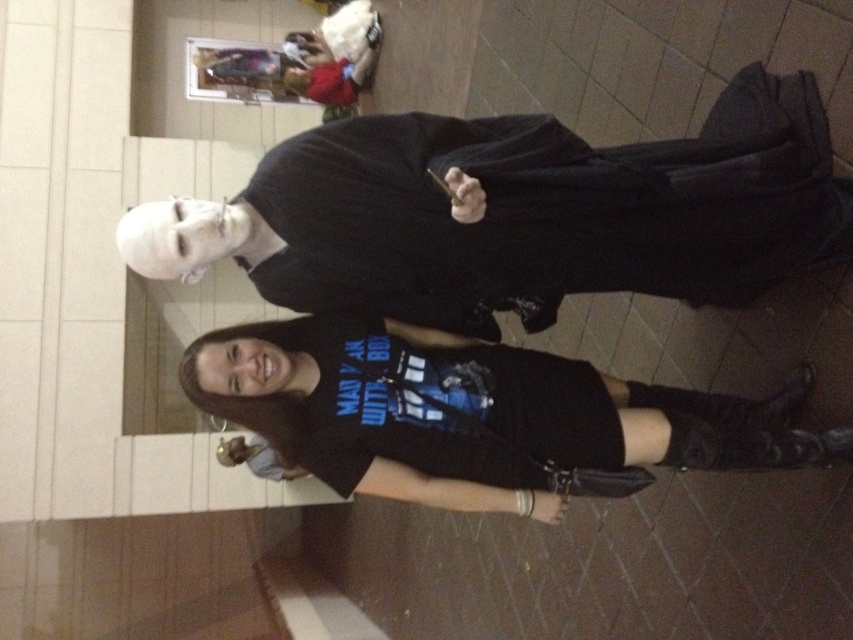
You are standing in a convention hall and see the black matte robe at upper center marked by point (529, 212). Can you determine if the robe is closer to the left or right side of the image based on its position?

The black matte robe at upper center is represented by point (529, 212), so it is closer to the left side of the image because the x coordinate is 0.333, which is less than 0.5.

You are standing at the point marked by the coordinates point (622, 228) and want to move towards the exit located directly behind you. How far will you have to walk to reach the exit?

The distance between you and the exit is 5.24 feet.